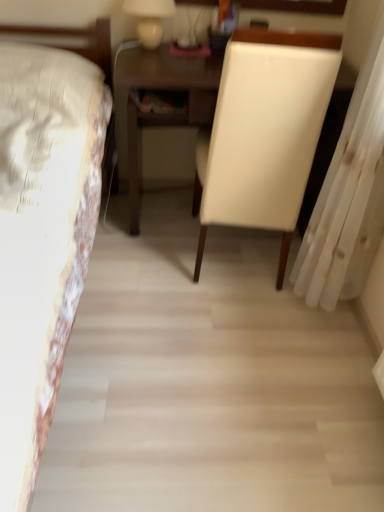
Locate an element on the screen. white floral fabric bed at left is located at coordinates (42, 238).

Measure the distance between white floral fabric bed at left and camera.

A distance of 24.88 inches exists between white floral fabric bed at left and camera.

Where is `white floral fabric bed at left`? This screenshot has height=512, width=384. white floral fabric bed at left is located at coordinates 42,238.

Does white floral fabric bed at left have a lesser height compared to matte white lamp at upper center?

No, white floral fabric bed at left is not shorter than matte white lamp at upper center.

Which of these two, white floral fabric bed at left or matte white lamp at upper center, is wider?

white floral fabric bed at left.

The height and width of the screenshot is (512, 384). What are the coordinates of `bedside lamp above the white floral fabric bed at left (from the image's perspective)` in the screenshot? It's located at (149, 19).

From the image's perspective, which one is positioned higher, matte white lamp at upper center or white leather chair at center?

matte white lamp at upper center appears higher in the image.

Considering the relative sizes of matte white lamp at upper center and white leather chair at center in the image provided, is matte white lamp at upper center wider than white leather chair at center?

No, matte white lamp at upper center is not wider than white leather chair at center.

Find the location of a particular element. Image resolution: width=384 pixels, height=512 pixels. bedside lamp positioned vertically above the white leather chair at center (from a real-world perspective) is located at coordinates (149, 19).

Is white leather chair at center surrounded by white floral fabric bed at left?

Definitely not — white leather chair at center is not inside white floral fabric bed at left.

Relative to white leather chair at center, is white floral fabric bed at left in front or behind?

white floral fabric bed at left is positioned closer to the viewer than white leather chair at center.

Considering the sizes of objects white floral fabric bed at left and white leather chair at center in the image provided, who is thinner, white floral fabric bed at left or white leather chair at center?

With smaller width is white leather chair at center.

Locate an element on the screen. chair to the right of white floral fabric bed at left is located at coordinates (264, 132).

Locate an element on the screen. This screenshot has width=384, height=512. bed in front of the matte white lamp at upper center is located at coordinates (42, 238).

From the picture: In terms of width, does matte white lamp at upper center look wider or thinner when compared to white floral fabric bed at left?

Clearly, matte white lamp at upper center has less width compared to white floral fabric bed at left.

From the image's perspective, between matte white lamp at upper center and white floral fabric bed at left, who is located below?

white floral fabric bed at left.

Considering the relative sizes of matte white lamp at upper center and white floral fabric bed at left in the image provided, is matte white lamp at upper center bigger than white floral fabric bed at left?

No, matte white lamp at upper center is not bigger than white floral fabric bed at left.

Would you consider white sheer curtain at right to be distant from white floral fabric bed at left?

No, there isn't a large distance between white sheer curtain at right and white floral fabric bed at left.

From a real-world perspective, is white sheer curtain at right over white floral fabric bed at left?

Yes, from a real-world perspective, white sheer curtain at right is on top of white floral fabric bed at left.

From the image's perspective, is white sheer curtain at right above or below white floral fabric bed at left?

Based on their image positions, white sheer curtain at right is located above white floral fabric bed at left.

Is white floral fabric bed at left inside or outside of white sheer curtain at right?

white floral fabric bed at left is outside white sheer curtain at right.

Consider the image. How far apart are white floral fabric bed at left and white sheer curtain at right?

white floral fabric bed at left and white sheer curtain at right are 35.78 inches apart.

From the picture: What's the angular difference between white floral fabric bed at left and white sheer curtain at right's facing directions?

The angular difference between white floral fabric bed at left and white sheer curtain at right is 95.8 degrees.

Considering the sizes of objects white floral fabric bed at left and white sheer curtain at right in the image provided, who is shorter, white floral fabric bed at left or white sheer curtain at right?

white floral fabric bed at left.

From a real-world perspective, relative to matte white lamp at upper center, is white leather chair at center vertically above or below?

Clearly, from a real-world perspective, white leather chair at center is below matte white lamp at upper center.

Considering the sizes of objects white leather chair at center and matte white lamp at upper center in the image provided, who is shorter, white leather chair at center or matte white lamp at upper center?

With less height is matte white lamp at upper center.

Considering the sizes of white leather chair at center and matte white lamp at upper center in the image, is white leather chair at center bigger or smaller than matte white lamp at upper center?

Considering their sizes, white leather chair at center takes up more space than matte white lamp at upper center.

From the image's perspective, which one is positioned higher, white leather chair at center or matte white lamp at upper center?

matte white lamp at upper center is shown above in the image.

The image size is (384, 512). I want to click on bedside lamp on the right of white floral fabric bed at left, so click(x=149, y=19).

The width and height of the screenshot is (384, 512). Identify the location of bedside lamp to the left of white leather chair at center. (149, 19).

Looking at this image, when comparing their distances from white sheer curtain at right, does white floral fabric bed at left or matte white lamp at upper center seem closer?

white floral fabric bed at left is closer to white sheer curtain at right.

When comparing their distances from white sheer curtain at right, does white floral fabric bed at left or white leather chair at center seem closer?

Based on the image, white leather chair at center appears to be nearer to white sheer curtain at right.

When comparing their distances from matte white lamp at upper center, does white floral fabric bed at left or white sheer curtain at right seem further?

white sheer curtain at right is further to matte white lamp at upper center.

From the image, which object appears to be nearer to white leather chair at center, white floral fabric bed at left or white sheer curtain at right?

Based on the image, white sheer curtain at right appears to be nearer to white leather chair at center.

Which object lies nearer to the anchor point white floral fabric bed at left, white sheer curtain at right or matte white lamp at upper center?

The object closer to white floral fabric bed at left is matte white lamp at upper center.

Considering their positions, is white sheer curtain at right positioned further to white floral fabric bed at left than white leather chair at center?

Based on the image, white sheer curtain at right appears to be further to white floral fabric bed at left.

Considering their positions, is white sheer curtain at right positioned closer to matte white lamp at upper center than white floral fabric bed at left?

white floral fabric bed at left lies closer to matte white lamp at upper center than the other object.

Considering their positions, is matte white lamp at upper center positioned closer to white sheer curtain at right than white leather chair at center?

white leather chair at center lies closer to white sheer curtain at right than the other object.

I want to click on curtain between white floral fabric bed at left and matte white lamp at upper center in the front-back direction, so click(x=348, y=199).

Find the location of a particular element. This screenshot has width=384, height=512. chair between white floral fabric bed at left and white sheer curtain at right from left to right is located at coordinates (264, 132).

The width and height of the screenshot is (384, 512). In order to click on chair between white floral fabric bed at left and matte white lamp at upper center in the front-back direction in this screenshot , I will do `click(264, 132)`.

At what (x,y) coordinates should I click in order to perform the action: click on chair that lies between matte white lamp at upper center and white sheer curtain at right from top to bottom. Please return your answer as a coordinate pair (x, y). This screenshot has width=384, height=512. Looking at the image, I should click on (264, 132).